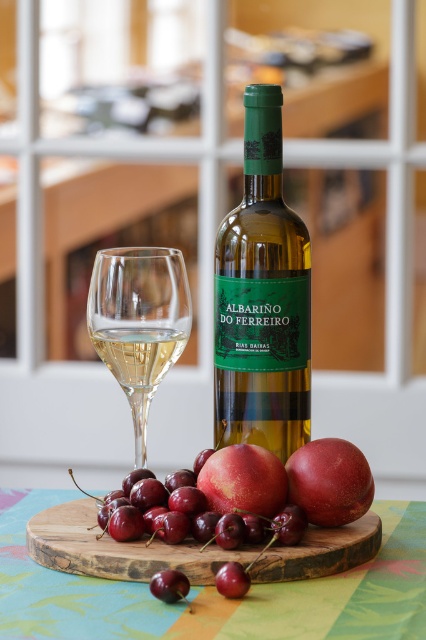
In the scene shown: You are standing in front of the still life setup described. There is a point marked at coordinates [138,323]. Which object from the scene is located at that point?

The clear glass wine glass at center is located at the point marked by coordinates [138,323].

You are a waiter trying to place a napkin on the table. The napkin must be placed exactly at point [138,323]. However, there is a clear glass wine glass at center on the table. Will placing the napkin at that point cause it to overlap with the glass?

The point [138,323] is on the clear glass wine glass at center, so placing the napkin there would overlap with the glass.

Consider the image. You are setting up a table for a dinner party and want to place the shiny red cherry at center on the edge of the clear glass wine glass at center. Based on their sizes, do you think the cherry will fit on the rim without falling off?

The clear glass wine glass at center might be wider than shiny red cherry at center, so there is a possibility that the cherry will fit on the rim without falling off, but it depends on the exact measurements.